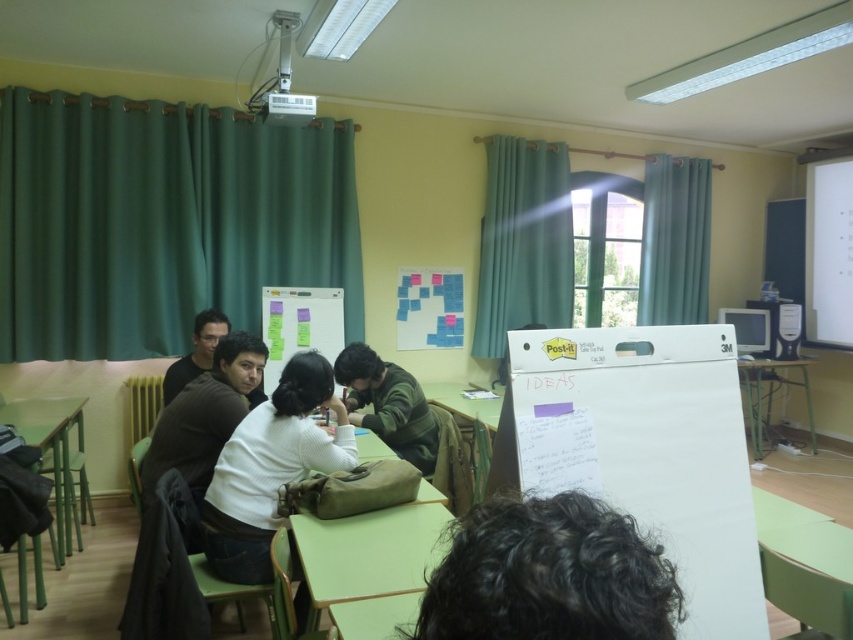
Question: Which object appears closest to the camera in this image?

Choices:
 (A) dark curly hair at lower center
 (B) white matte bulletin board at center

Answer: (A)

Question: Can you confirm if white matte shirt at center is positioned above green striped sweater at center?

Choices:
 (A) no
 (B) yes

Answer: (B)

Question: Which point is farther to the camera?

Choices:
 (A) green plastic table at lower left
 (B) teal fabric curtain at upper right
 (C) dark brown sweater at left
 (D) white matte bulletin board at center

Answer: (B)

Question: Is white matte board at upper right above dark brown sweater at left?

Choices:
 (A) yes
 (B) no

Answer: (A)

Question: Among these points, which one is nearest to the camera?

Choices:
 (A) (537, 220)
 (B) (773, 385)
 (C) (24, 420)

Answer: (C)

Question: Can you confirm if teal fabric curtain at center is positioned to the left of white matte shirt at center?

Choices:
 (A) yes
 (B) no

Answer: (B)